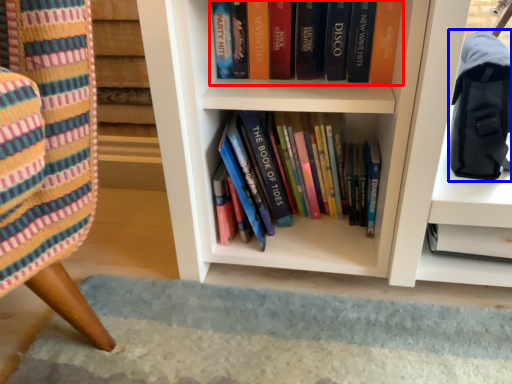
Question: Among these objects, which one is nearest to the camera, book (highlighted by a red box) or shoulder bag (highlighted by a blue box)?

Choices:
 (A) book
 (B) shoulder bag

Answer: (B)